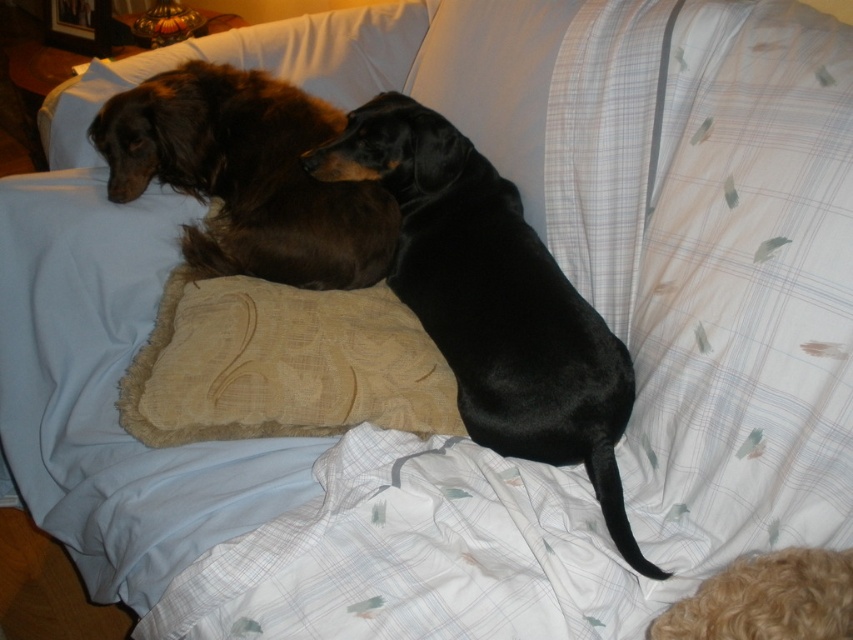
Question: Does black smooth dog at center appear on the right side of shiny brown fur at upper left?

Choices:
 (A) yes
 (B) no

Answer: (A)

Question: Can you confirm if black smooth dog at center is wider than shiny brown fur at upper left?

Choices:
 (A) yes
 (B) no

Answer: (B)

Question: Does black smooth dog at center lie in front of shiny brown fur at upper left?

Choices:
 (A) yes
 (B) no

Answer: (A)

Question: Which of the following is the farthest from the observer?

Choices:
 (A) (476, 360)
 (B) (271, 120)

Answer: (B)

Question: Which object appears closest to the camera in this image?

Choices:
 (A) black smooth dog at center
 (B) shiny brown fur at upper left

Answer: (A)